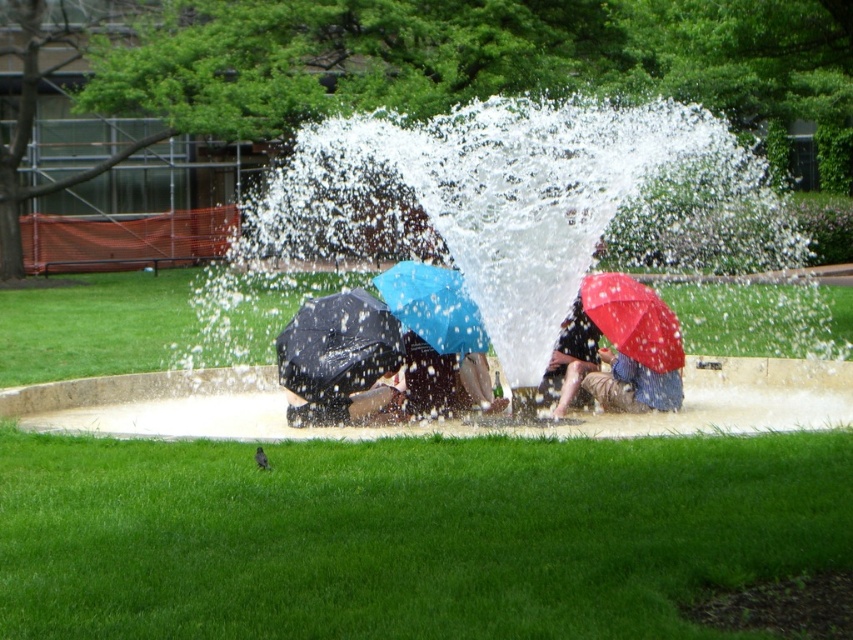
Who is taller, white frothy water at center or matte black umbrella at center?

With more height is white frothy water at center.

Is white frothy water at center positioned in front of matte black umbrella at center?

Yes.

What do you see at coordinates (525, 202) in the screenshot? This screenshot has width=853, height=640. I see `white frothy water at center` at bounding box center [525, 202].

Locate an element on the screen. white frothy water at center is located at coordinates (525, 202).

Which of these two, blue matte umbrella at center or red matte umbrella at center, stands shorter?

Standing shorter between the two is blue matte umbrella at center.

Measure the distance between point (468, 323) and camera.

Point (468, 323) and camera are 12.57 meters apart from each other.

The image size is (853, 640). Find the location of `blue matte umbrella at center`. blue matte umbrella at center is located at coordinates (433, 307).

Is white frothy water at center behind matte red umbrella at center?

That is False.

Who is more forward, (386, 252) or (653, 408)?

Positioned in front is point (653, 408).

Between point (506, 102) and point (608, 349), which one is positioned behind?

Positioned behind is point (506, 102).

The image size is (853, 640). Identify the location of white frothy water at center. (525, 202).